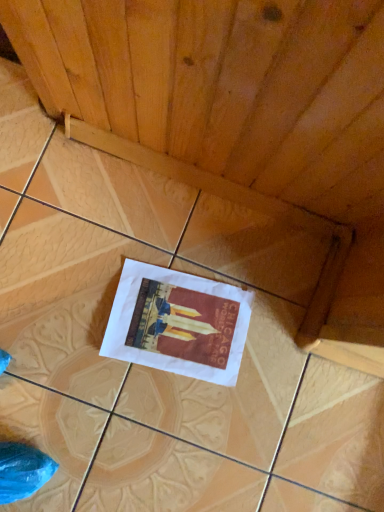
Find the location of a particular element. This screenshot has height=512, width=384. white paper poster at center is located at coordinates (178, 323).

What do you see at coordinates (178, 323) in the screenshot? I see `white paper poster at center` at bounding box center [178, 323].

The image size is (384, 512). I want to click on wooden at center, so [x=236, y=114].

This screenshot has height=512, width=384. Describe the element at coordinates (236, 114) in the screenshot. I see `wooden at center` at that location.

This screenshot has width=384, height=512. I want to click on white paper poster at center, so click(178, 323).

Is white paper poster at center to the right of wooden at center from the viewer's perspective?

Yes, white paper poster at center is to the right of wooden at center.

Which object is closer to the camera taking this photo, white paper poster at center or wooden at center?

wooden at center is closer to the camera.

Which is behind, point (227, 369) or point (364, 4)?

Positioned behind is point (227, 369).

From the image's perspective, is white paper poster at center above or below wooden at center?

Clearly, from the image's perspective, white paper poster at center is below wooden at center.

From a real-world perspective, is white paper poster at center under wooden at center?

No, from a real-world perspective, white paper poster at center is not beneath wooden at center.

Is white paper poster at center wider than wooden at center?

In fact, white paper poster at center might be narrower than wooden at center.

Can you confirm if white paper poster at center is taller than wooden at center?

In fact, white paper poster at center may be shorter than wooden at center.

Looking at the image, does white paper poster at center seem bigger or smaller compared to wooden at center?

Considering their sizes, white paper poster at center takes up less space than wooden at center.

Which is correct: white paper poster at center is inside wooden at center, or outside of it?

white paper poster at center is contained in wooden at center.

Is white paper poster at center in contact with wooden at center?

They are not placed beside each other.

Is white paper poster at center looking in the opposite direction of wooden at center?

Yes, white paper poster at center is facing away from wooden at center.

Find the location of `plywood below the white paper poster at center (from a real-world perspective)`. plywood below the white paper poster at center (from a real-world perspective) is located at coordinates (236, 114).

Can you confirm if wooden at center is positioned to the right of white paper poster at center?

In fact, wooden at center is to the left of white paper poster at center.

Is wooden at center positioned behind white paper poster at center?

No, it is in front of white paper poster at center.

Which point is more distant from viewer, [306,146] or [231,357]?

The point [231,357] is farther from the camera.

From the image's perspective, which object appears higher, wooden at center or white paper poster at center?

wooden at center appears higher in the image.

From a real-world perspective, is wooden at center positioned above or below white paper poster at center?

From a real-world perspective, wooden at center is physically below white paper poster at center.

In terms of width, does wooden at center look wider or thinner when compared to white paper poster at center?

In the image, wooden at center appears to be wider than white paper poster at center.

Does wooden at center have a lesser height compared to white paper poster at center?

No.

Who is bigger, wooden at center or white paper poster at center?

Bigger between the two is wooden at center.

Can we say wooden at center lies outside white paper poster at center?

Indeed, wooden at center is completely outside white paper poster at center.

Is wooden at center placed right next to white paper poster at center?

No.

Is wooden at center oriented towards white paper poster at center?

No, wooden at center is not aimed at white paper poster at center.

How different are the orientations of wooden at center and white paper poster at center in degrees?

wooden at center and white paper poster at center are facing 82.5 degrees away from each other.

Measure the distance between wooden at center and white paper poster at center.

wooden at center is 12.50 inches from white paper poster at center.

In the image, there is a white paper poster at center. Where is `plywood above it (from the image's perspective)`? The width and height of the screenshot is (384, 512). plywood above it (from the image's perspective) is located at coordinates (236, 114).

Where is `plywood on the left of white paper poster at center`? Image resolution: width=384 pixels, height=512 pixels. plywood on the left of white paper poster at center is located at coordinates (236, 114).

At what (x,y) coordinates should I click in order to perform the action: click on plywood that appears below the white paper poster at center (from a real-world perspective). Please return your answer as a coordinate pair (x, y). This screenshot has height=512, width=384. Looking at the image, I should click on (236, 114).